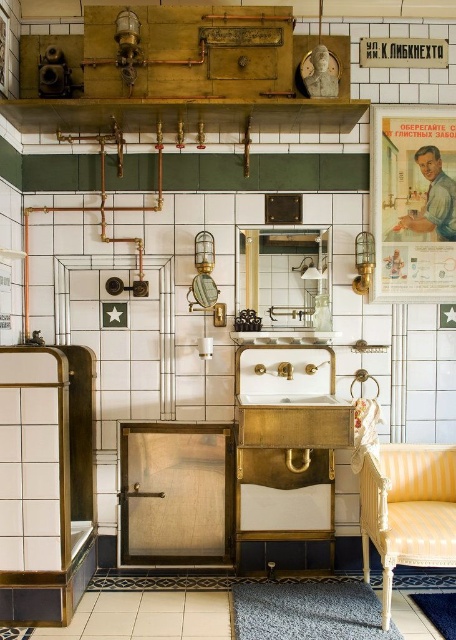
Question: Which object is closer to the camera taking this photo?

Choices:
 (A) matte paper poster at upper right
 (B) yellow striped chair at lower right

Answer: (B)

Question: Is matte paper poster at upper right positioned at the back of yellow striped chair at lower right?

Choices:
 (A) yes
 (B) no

Answer: (A)

Question: Is matte paper poster at upper right to the left of yellow striped chair at lower right from the viewer's perspective?

Choices:
 (A) yes
 (B) no

Answer: (B)

Question: Which point is closer to the camera taking this photo?

Choices:
 (A) (381, 554)
 (B) (426, 260)

Answer: (A)

Question: Which point appears closest to the camera in this image?

Choices:
 (A) (388, 195)
 (B) (445, 525)

Answer: (B)

Question: Does matte paper poster at upper right have a greater width compared to yellow striped chair at lower right?

Choices:
 (A) yes
 (B) no

Answer: (B)